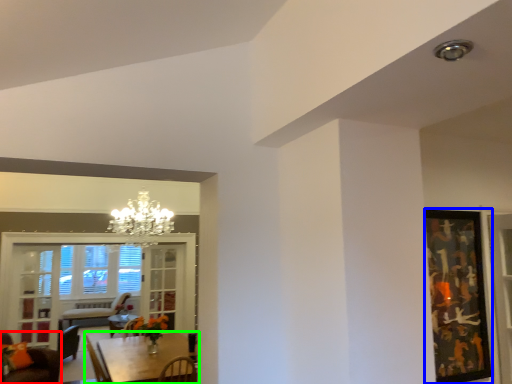
Question: Estimate the real-world distances between objects in this image. Which object is closer to chair (highlighted by a red box), picture frame (highlighted by a blue box) or table (highlighted by a green box)?

Choices:
 (A) picture frame
 (B) table

Answer: (B)